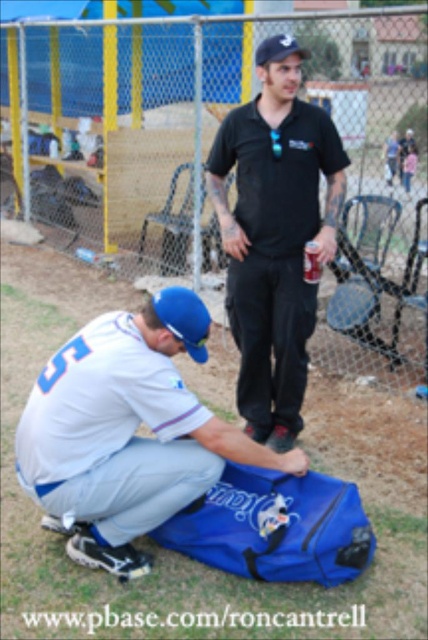
You are a photographer positioned at the edge of the baseball field. You want to take a photo of both the blue fabric bag at lower center and the black matte shirt at center in the same frame. The camera you have can capture objects within a 1.2 meter range. Will both objects fit in the shot?

The blue fabric bag at lower center and the black matte shirt at center are 1.13 meters apart from each other. Since the camera can capture objects within a 1.2 meter range, both objects will fit in the shot as the distance between them is less than the camera range.

You are a photographer standing at the edge of the baseball field. You want to take a photo that includes both the black matte shirt at center and the blue fabric baseball bag at upper right. Given that your camera has a maximum focus range of 6 feet, will you be able to capture both objects in focus without moving your position?

The black matte shirt at center and blue fabric baseball bag at upper right are 6.98 feet apart from each other. Since the distance between them exceeds the camera maximum focus range of 6 feet, you will not be able to capture both objects in focus without moving your position.

You are a photographer trying to capture a clear shot of both the black matte shirt at center and the blue fabric baseball bag at upper right. Based on their positions, which object should you focus on first to ensure both are in frame?

The black matte shirt at center is positioned under the blue fabric baseball bag at upper right, so focusing on the black matte shirt at center first would allow you to adjust the framing to include both objects in the composition.